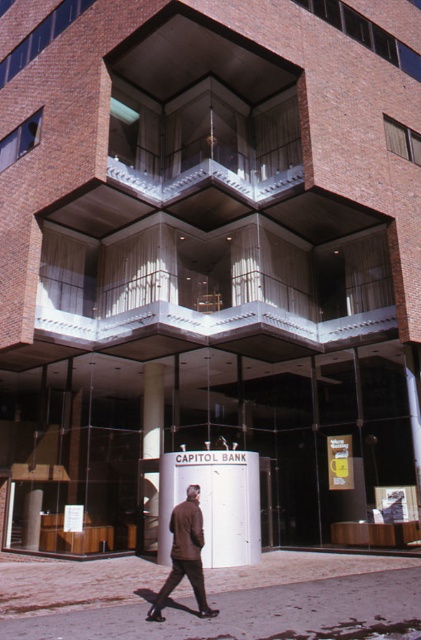
Is white glossy pillar at center below brown leather jacket at lower center?

Indeed, white glossy pillar at center is positioned under brown leather jacket at lower center.

Based on the photo, which is above, white glossy pillar at center or brown leather jacket at lower center?

brown leather jacket at lower center

Who is more forward, (156, 422) or (173, 556)?

Point (173, 556)

Image resolution: width=421 pixels, height=640 pixels. In order to click on white glossy pillar at center in this screenshot , I will do `click(151, 454)`.

Who is shorter, smooth concrete pavement at lower center or brown leather jacket at lower center?

Standing shorter between the two is brown leather jacket at lower center.

Which is more to the right, smooth concrete pavement at lower center or brown leather jacket at lower center?

smooth concrete pavement at lower center is more to the right.

Between point (335, 618) and point (191, 529), which one is positioned in front?

Point (335, 618) is more forward.

Find the location of a particular element. The image size is (421, 640). smooth concrete pavement at lower center is located at coordinates (215, 600).

Does smooth concrete pavement at lower center have a lesser height compared to white glossy pillar at center?

No, smooth concrete pavement at lower center is not shorter than white glossy pillar at center.

Is point (178, 612) closer to camera compared to point (143, 442)?

Yes.

Describe the element at coordinates (215, 600) in the screenshot. Image resolution: width=421 pixels, height=640 pixels. I see `smooth concrete pavement at lower center` at that location.

This screenshot has height=640, width=421. I want to click on smooth concrete pavement at lower center, so click(215, 600).